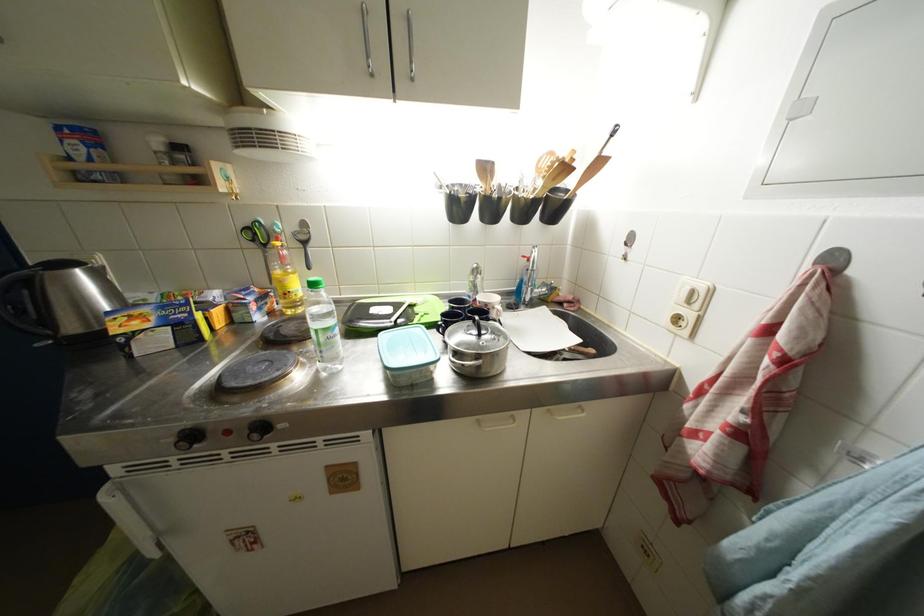
The width and height of the screenshot is (924, 616). Describe the element at coordinates (477, 325) in the screenshot. I see `the pot lid handle` at that location.